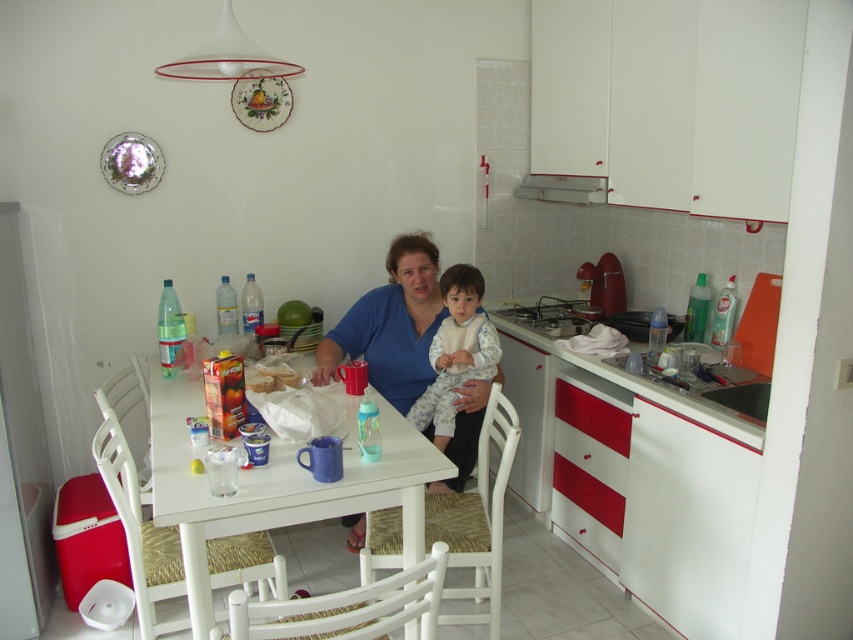
Is blue fabric shirt at center positioned before fluffy white pajamas at center?

Yes.

Is point (444, 490) less distant than point (465, 294)?

Yes, point (444, 490) is closer to viewer.

In order to click on blue fabric shirt at center in this screenshot , I will do `click(392, 324)`.

Is white glossy table at center positioned at the back of blue fabric shirt at center?

No, white glossy table at center is in front of blue fabric shirt at center.

Image resolution: width=853 pixels, height=640 pixels. What do you see at coordinates (277, 484) in the screenshot? I see `white glossy table at center` at bounding box center [277, 484].

Does point (393, 480) come behind point (363, 532)?

No, it is not.

Find the location of a particular element. white glossy table at center is located at coordinates (277, 484).

This screenshot has height=640, width=853. What do you see at coordinates (277, 484) in the screenshot?
I see `white glossy table at center` at bounding box center [277, 484].

This screenshot has width=853, height=640. Identify the location of white glossy table at center. point(277,484).